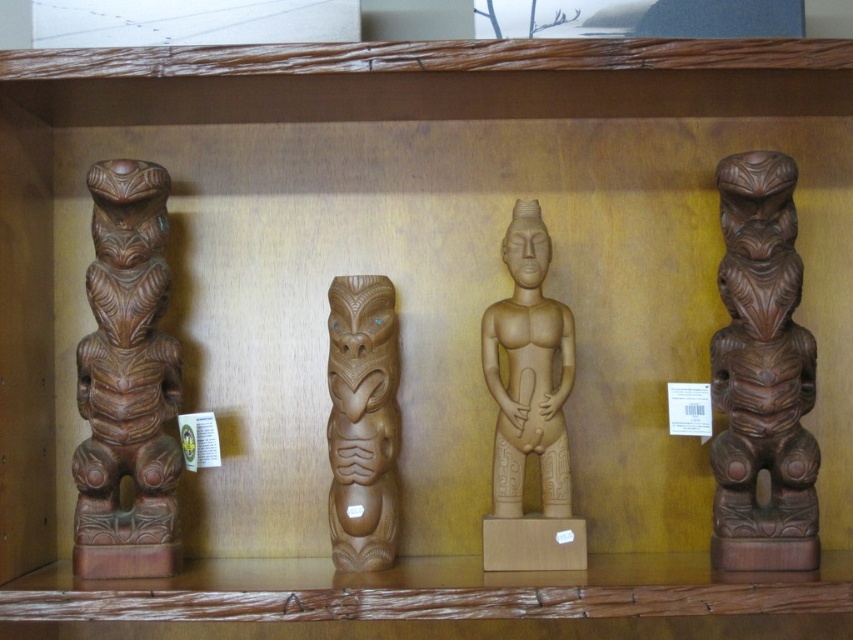
You are an art curator arranging a display. You have two central pieces, the brown wood carving at center and the light brown wood statue at center. Which one should you place on the higher shelf to maintain visual balance?

The light brown wood statue at center is taller than the brown wood carving at center, so placing it on the higher shelf would maintain visual balance by aligning their heights appropriately.

You are standing in front of the wooden display shelf with the four figures. You notice two points marked on the figures. One is at point (114,545) and the other is at point (543,481). Which point is closer to you?

Point (114,545) is closer to the viewer than point (543,481).

You are standing in front of the wooden display shelf and want to place a new object on the shelf. The new object must be placed to the right of the brown polished wood totem at left. Where should you place it?

You should place the new object to the right of the brown polished wood totem at left, which is located at point (126, 381) on the shelf.